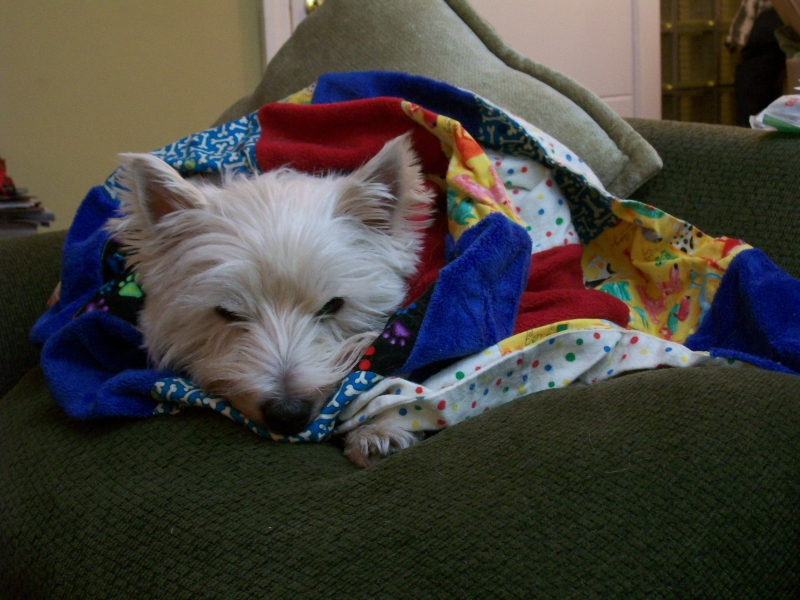
At what (x,y) coordinates should I click in order to perform the action: click on blanket. Please return your answer as a coordinate pair (x, y). Looking at the image, I should click on (480, 304).